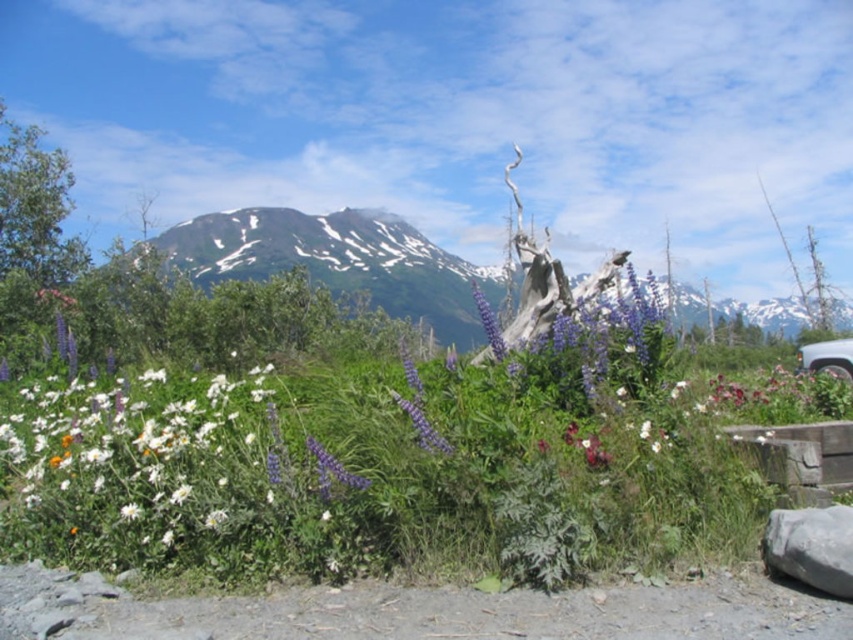
From the picture: You are standing at the center of the image and want to pick the purple matte flower at center. Which direction should you move to reach it?

The purple matte flower at center is already at the center of the image, so you don not need to move in any direction to reach it.

You are standing in the natural landscape and want to place a 4 meter long bench. Can you determine if there is enough space between you and the green leafy grass at center to place the bench?

The distance between you and the green leafy grass at center is 3.94 meters, so the bench is slightly longer than the available space. You may need to adjust the bench or choose a shorter one to fit.

You are a photographer trying to capture the purple matte flower at center and the purple matte lupine at center in a single shot. Which one should you focus on first to ensure both are in clear view?

You should focus on the purple matte lupine at center first because it is farther away from the viewer than the purple matte flower at center, ensuring both are in focus when using depth of field.